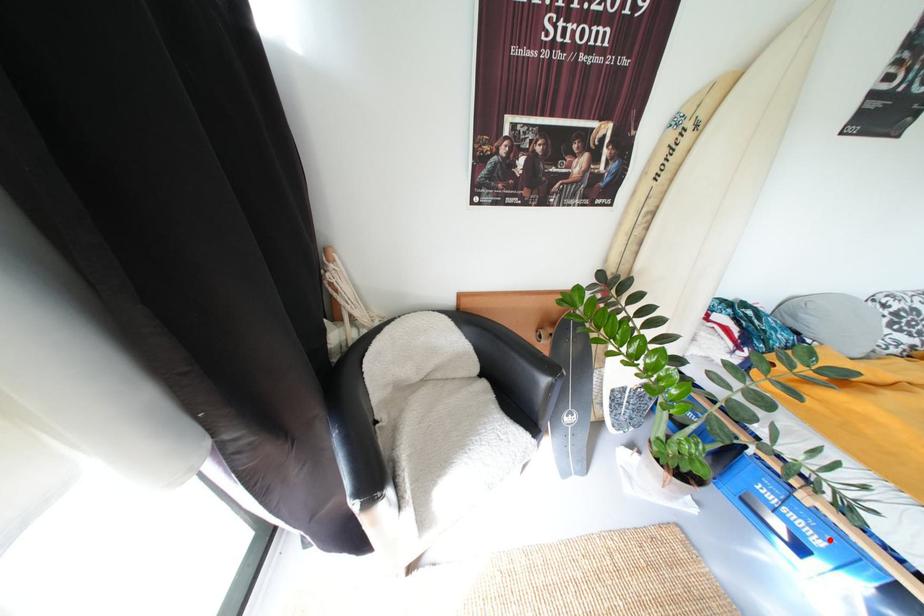
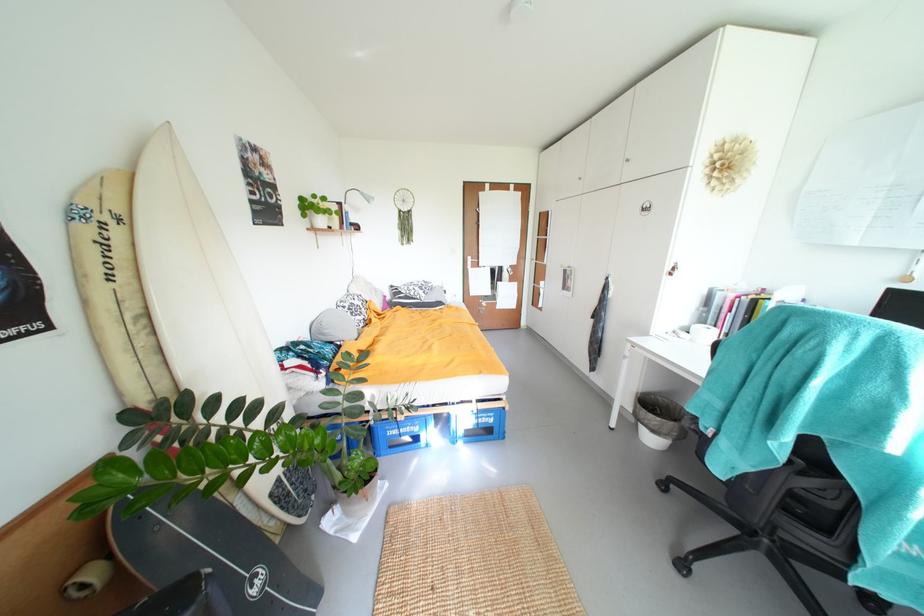
Question: I am providing you with two images of the same scene from different viewpoints. Given a red point in image1, look at the same physical point in image2. Is it:

Choices:
 (A) Closer to the viewpoint
 (B) Farther from the viewpoint

Answer: (B)